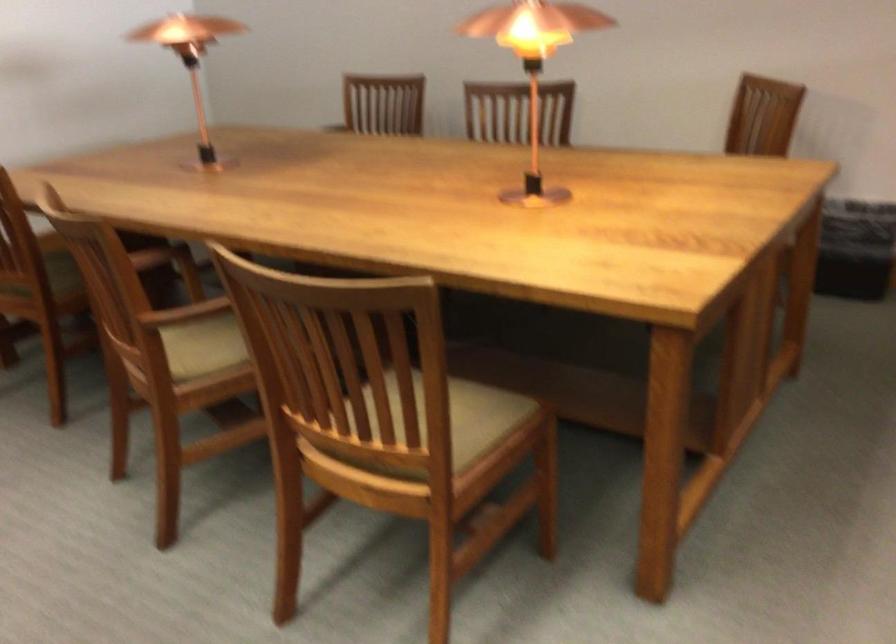
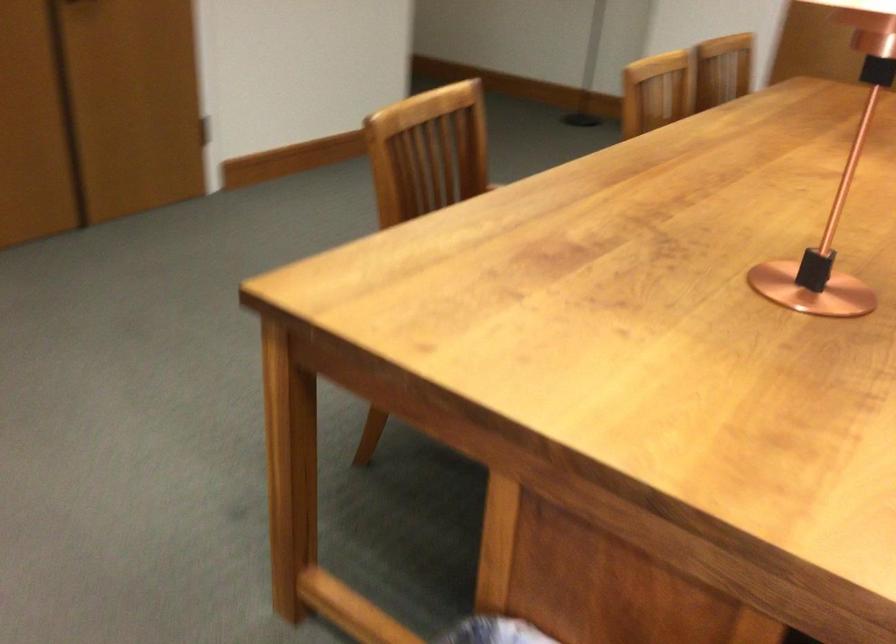
Based on the continuous images, in which direction is the camera rotating?

The camera rotated toward left-down.